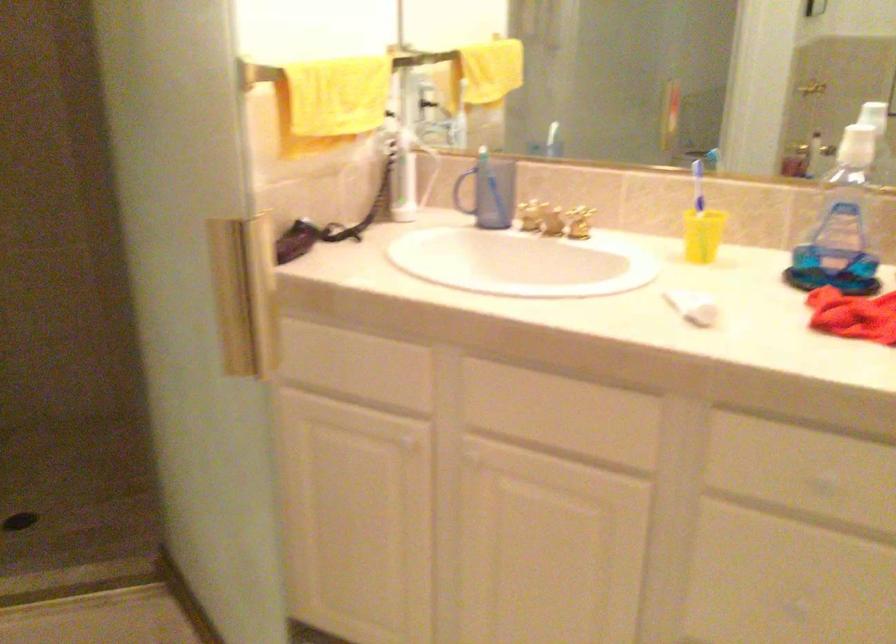
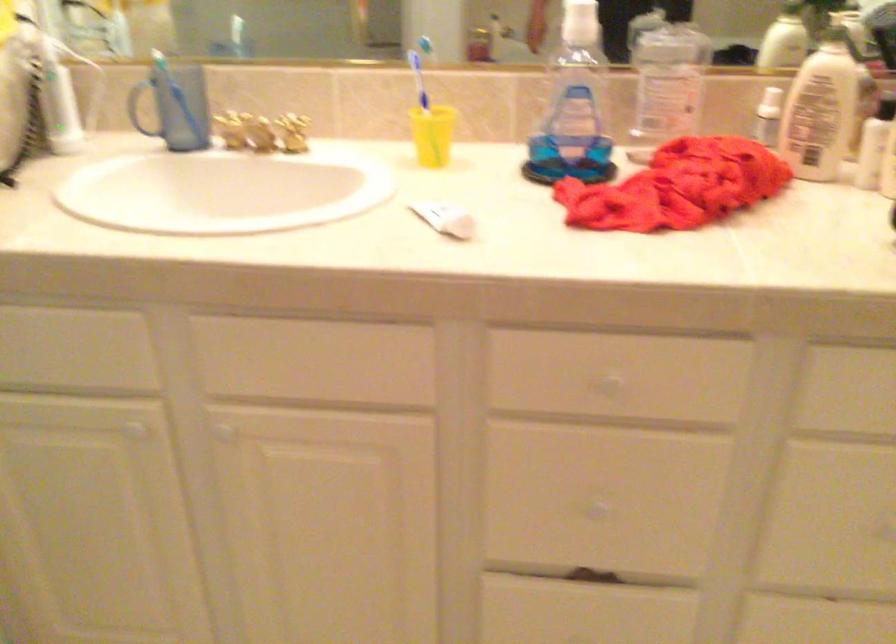
Question: Based on the continuous images, in which direction is the camera rotating? Reply with the corresponding letter.

Choices:
 (A) Left
 (B) Right
 (C) Up
 (D) Down

Answer: (B)